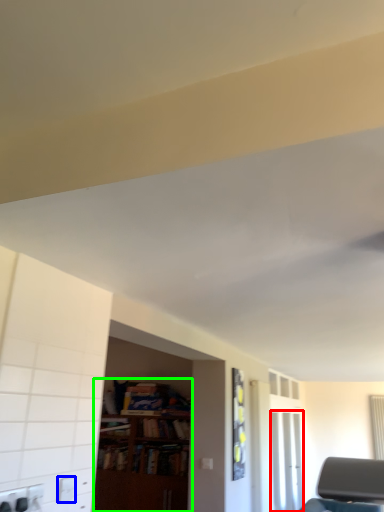
Question: Estimate the real-world distances between objects in this image. Which object is farther from glass door (highlighted by a red box), electric outlet (highlighted by a blue box) or bookcase (highlighted by a green box)?

Choices:
 (A) electric outlet
 (B) bookcase

Answer: (A)